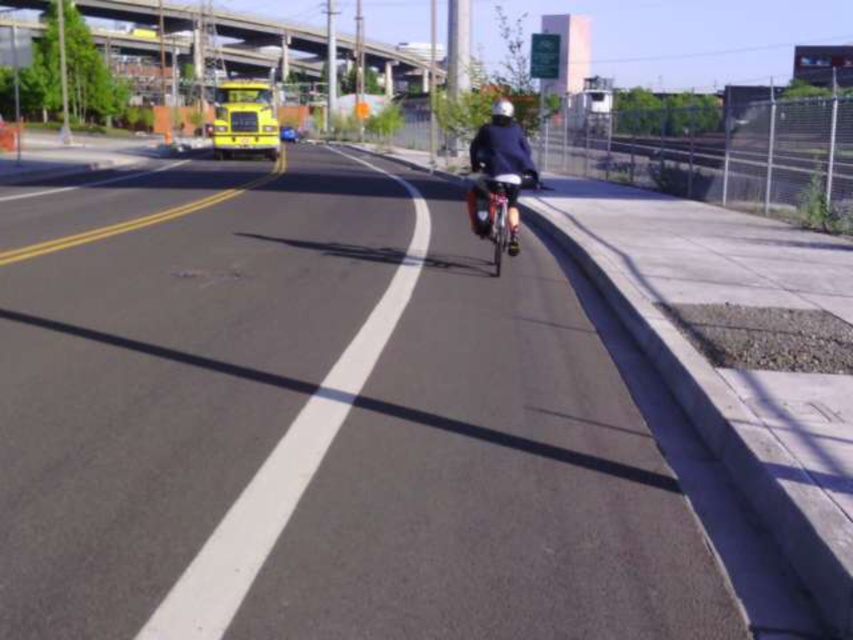
Question: Is asphalt road at center above concrete bridge at upper center?

Choices:
 (A) yes
 (B) no

Answer: (B)

Question: In this image, where is asphalt road at center located relative to dark blue fabric at center?

Choices:
 (A) below
 (B) above

Answer: (A)

Question: Which is nearer to the asphalt road at center?

Choices:
 (A) metallic silver bicycle at center
 (B) concrete bridge at upper center
 (C) dark blue fabric at center

Answer: (A)

Question: In this image, where is asphalt road at center located relative to metallic silver bicycle at center?

Choices:
 (A) below
 (B) above

Answer: (A)

Question: Which point is farther from the camera taking this photo?

Choices:
 (A) (221, 292)
 (B) (485, 214)

Answer: (B)

Question: Which object appears closest to the camera in this image?

Choices:
 (A) asphalt road at center
 (B) metallic silver bicycle at center
 (C) dark blue fabric at center

Answer: (A)